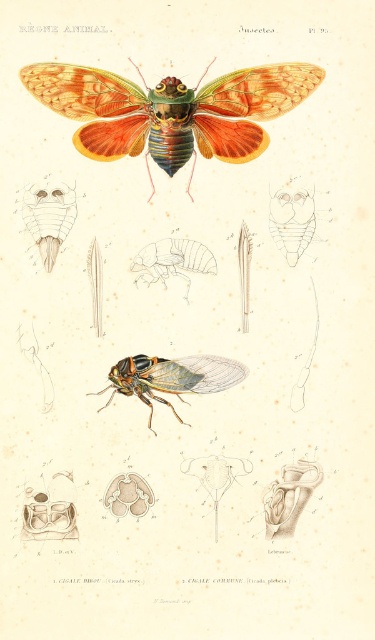
Question: Which of the following is the farthest from the observer?

Choices:
 (A) translucent orange winged insect at center
 (B) shiny metallic cicada at upper center

Answer: (A)

Question: Does shiny metallic cicada at upper center come behind translucent orange winged insect at center?

Choices:
 (A) no
 (B) yes

Answer: (A)

Question: Does shiny metallic cicada at upper center appear on the left side of translucent orange winged insect at center?

Choices:
 (A) yes
 (B) no

Answer: (A)

Question: Can you confirm if shiny metallic cicada at upper center is positioned above translucent orange winged insect at center?

Choices:
 (A) yes
 (B) no

Answer: (A)

Question: Which of the following is the farthest from the observer?

Choices:
 (A) (235, 372)
 (B) (241, 140)

Answer: (A)